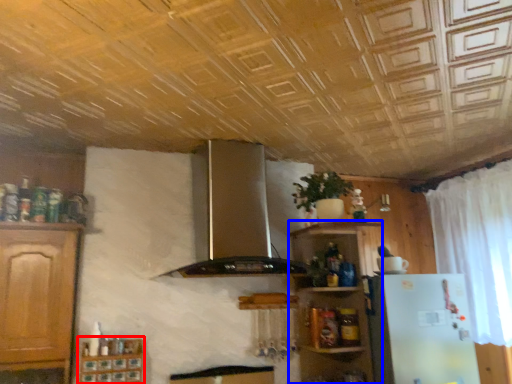
Question: Which object appears closest to the camera in this image, cabinetry (highlighted by a red box) or shelf (highlighted by a blue box)?

Choices:
 (A) cabinetry
 (B) shelf

Answer: (A)